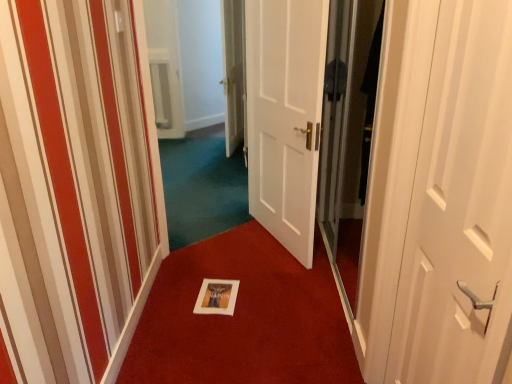
Question: Is white paper at center positioned before white glossy door at center, which is counted as the third door, starting from the right?

Choices:
 (A) yes
 (B) no

Answer: (A)

Question: Does white paper at center have a lesser width compared to white glossy door at center, which ranks as the 1th door in left-to-right order?

Choices:
 (A) yes
 (B) no

Answer: (B)

Question: From the image's perspective, would you say white paper at center is shown under white glossy door at center, the third door viewed from the front?

Choices:
 (A) no
 (B) yes

Answer: (B)

Question: Does white paper at center have a greater height compared to white glossy door at center, the third door viewed from the front?

Choices:
 (A) no
 (B) yes

Answer: (A)

Question: Is white glossy door at center, the third door viewed from the front, at the back of white paper at center?

Choices:
 (A) yes
 (B) no

Answer: (B)

Question: Considering the positions of white matte door at center, which appears as the 2th door when viewed from the left, and white glossy door at center, which is counted as the third door, starting from the right, in the image, is white matte door at center, which appears as the 2th door when viewed from the left, taller or shorter than white glossy door at center, which is counted as the third door, starting from the right,?

Choices:
 (A) tall
 (B) short

Answer: (A)

Question: Considering the positions of point (302, 190) and point (234, 51), is point (302, 190) closer or farther from the camera than point (234, 51)?

Choices:
 (A) farther
 (B) closer

Answer: (B)

Question: Looking at their shapes, would you say white matte door at center, which appears as the 2th door when viewed from the left, is wider or thinner than white glossy door at center, which is the 1th door in back-to-front order?

Choices:
 (A) thin
 (B) wide

Answer: (A)

Question: From a real-world perspective, is white matte door at center, the 2th door when ordered from back to front, positioned above or below white glossy door at center, which is counted as the third door, starting from the right?

Choices:
 (A) above
 (B) below

Answer: (B)

Question: Is point (330, 134) closer or farther from the camera than point (150, 317)?

Choices:
 (A) closer
 (B) farther

Answer: (B)

Question: Considering their positions, is transparent glass screen door at right located in front of or behind white paper at center?

Choices:
 (A) behind
 (B) front

Answer: (B)

Question: From the image's perspective, is transparent glass screen door at right above or below white paper at center?

Choices:
 (A) above
 (B) below

Answer: (A)

Question: Considering the relative positions of transparent glass screen door at right and white paper at center in the image provided, is transparent glass screen door at right to the left or to the right of white paper at center?

Choices:
 (A) left
 (B) right

Answer: (B)

Question: Considering the positions of white glossy door at center, which is the 1th door in back-to-front order, and transparent glass screen door at right in the image, is white glossy door at center, which is the 1th door in back-to-front order, taller or shorter than transparent glass screen door at right?

Choices:
 (A) short
 (B) tall

Answer: (A)

Question: From the image's perspective, is white glossy door at center, which ranks as the 1th door in left-to-right order, positioned above or below transparent glass screen door at right?

Choices:
 (A) below
 (B) above

Answer: (B)